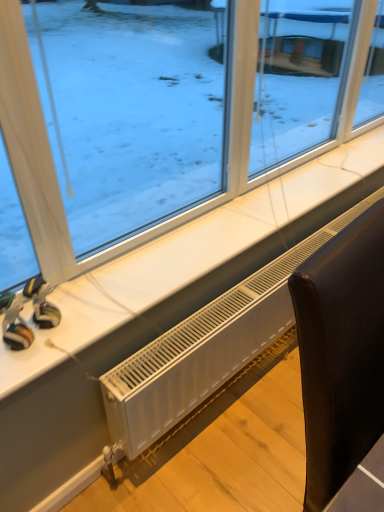
Locate an element on the screen. free point to the right of rubberized plastic toy at lower left, the second toy in the right-to-left sequence is located at coordinates (x=76, y=331).